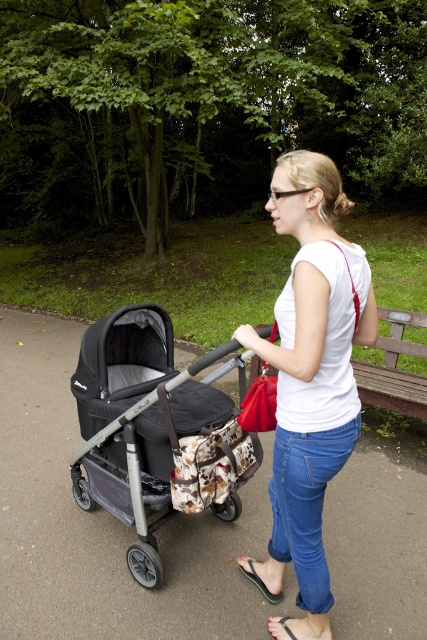
Question: Is the position of black fabric baby carriage at left less distant than that of black leather sandal at lower center?

Choices:
 (A) yes
 (B) no

Answer: (A)

Question: Is black fabric baby carriage at left below black fabric sandal at lower center?

Choices:
 (A) no
 (B) yes

Answer: (A)

Question: Which point is farther to the camera?

Choices:
 (A) brown wooden bench at center
 (B) black leather sandal at lower center
 (C) white matte shirt at center
 (D) black fabric sandal at lower center

Answer: (A)

Question: Can you confirm if smooth gray stroller at center is bigger than white matte shirt at center?

Choices:
 (A) yes
 (B) no

Answer: (A)

Question: Which object appears closest to the camera in this image?

Choices:
 (A) black leather sandal at lower center
 (B) black fabric sandal at lower center
 (C) black fabric baby carriage at left

Answer: (C)

Question: Which is nearer to the black fabric baby carriage at left?

Choices:
 (A) black leather sandal at lower center
 (B) brown wooden bench at center

Answer: (A)